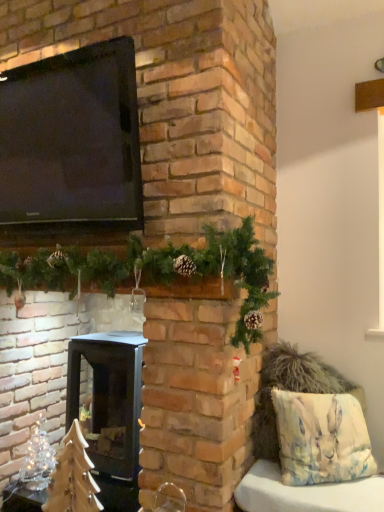
Question: From the image's perspective, is green pinecone garland at upper center, the 2th christmas decoration from the left, beneath clear glass christmas tree at lower left, the first christmas decoration viewed from the left?

Choices:
 (A) no
 (B) yes

Answer: (A)

Question: From the image's perspective, would you say green pinecone garland at upper center, arranged as the first christmas decoration when viewed from the right, is positioned over clear glass christmas tree at lower left, the first christmas decoration in the back-to-front sequence?

Choices:
 (A) no
 (B) yes

Answer: (B)

Question: Is green pinecone garland at upper center, marked as the second christmas decoration in a bottom-to-top arrangement, oriented away from clear glass christmas tree at lower left, the first christmas decoration in the back-to-front sequence?

Choices:
 (A) no
 (B) yes

Answer: (A)

Question: From a real-world perspective, does green pinecone garland at upper center, the 2th christmas decoration from the left, stand above clear glass christmas tree at lower left, which is the second christmas decoration in front-to-back order?

Choices:
 (A) no
 (B) yes

Answer: (B)

Question: Considering the relative sizes of green pinecone garland at upper center, the 2th christmas decoration from the left, and clear glass christmas tree at lower left, the first christmas decoration viewed from the left, in the image provided, is green pinecone garland at upper center, the 2th christmas decoration from the left, smaller than clear glass christmas tree at lower left, the first christmas decoration viewed from the left,?

Choices:
 (A) no
 (B) yes

Answer: (A)

Question: Is clear glass christmas tree at lower left, the 2th christmas decoration positioned from the top, taller or shorter than black matte wood burning stove at center?

Choices:
 (A) tall
 (B) short

Answer: (B)

Question: Based on their positions, is clear glass christmas tree at lower left, which is the first christmas decoration from bottom to top, located to the left or right of black matte wood burning stove at center?

Choices:
 (A) right
 (B) left

Answer: (B)

Question: Is point (23, 477) closer or farther from the camera than point (102, 490)?

Choices:
 (A) closer
 (B) farther

Answer: (B)

Question: From the image's perspective, is clear glass christmas tree at lower left, which is the first christmas decoration from bottom to top, positioned above or below black matte wood burning stove at center?

Choices:
 (A) above
 (B) below

Answer: (B)

Question: Is clear glass christmas tree at lower left, which is the first christmas decoration from bottom to top, inside the boundaries of green pinecone garland at upper center, marked as the 1th christmas decoration in a front-to-back arrangement, or outside?

Choices:
 (A) inside
 (B) outside

Answer: (B)

Question: Would you say clear glass christmas tree at lower left, the first christmas decoration viewed from the left, is to the left or to the right of green pinecone garland at upper center, arranged as the first christmas decoration when viewed from the right, in the picture?

Choices:
 (A) right
 (B) left

Answer: (B)

Question: From a real-world perspective, relative to green pinecone garland at upper center, the 1th christmas decoration in the top-to-bottom sequence, is clear glass christmas tree at lower left, the first christmas decoration in the back-to-front sequence, vertically above or below?

Choices:
 (A) above
 (B) below

Answer: (B)

Question: From the image's perspective, is clear glass christmas tree at lower left, the first christmas decoration viewed from the left, above or below green pinecone garland at upper center, the 1th christmas decoration in the top-to-bottom sequence?

Choices:
 (A) below
 (B) above

Answer: (A)

Question: Is black glossy tv at upper left to the left or to the right of black matte wood burning stove at center in the image?

Choices:
 (A) right
 (B) left

Answer: (B)

Question: Considering the positions of black glossy tv at upper left and black matte wood burning stove at center in the image, is black glossy tv at upper left wider or thinner than black matte wood burning stove at center?

Choices:
 (A) wide
 (B) thin

Answer: (B)